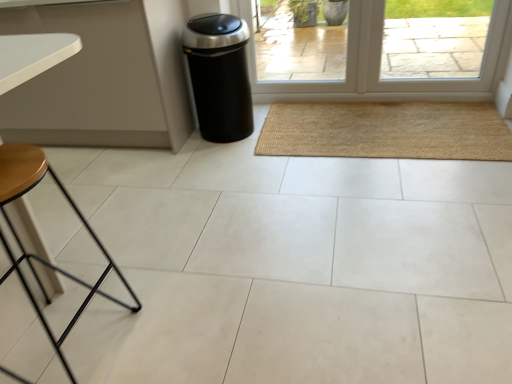
What are the coordinates of `free point to the right of black matte trash can at center-left` in the screenshot? It's located at 286,124.